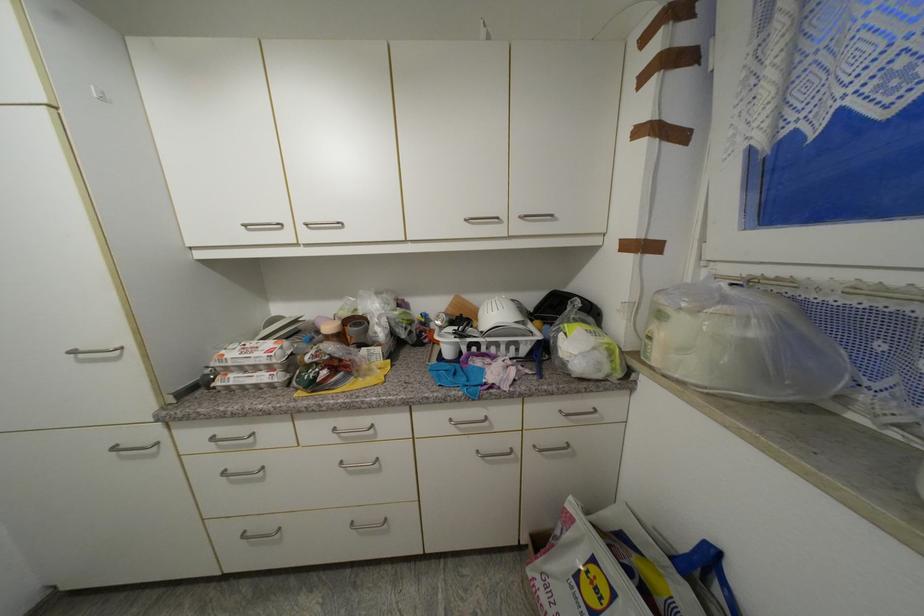
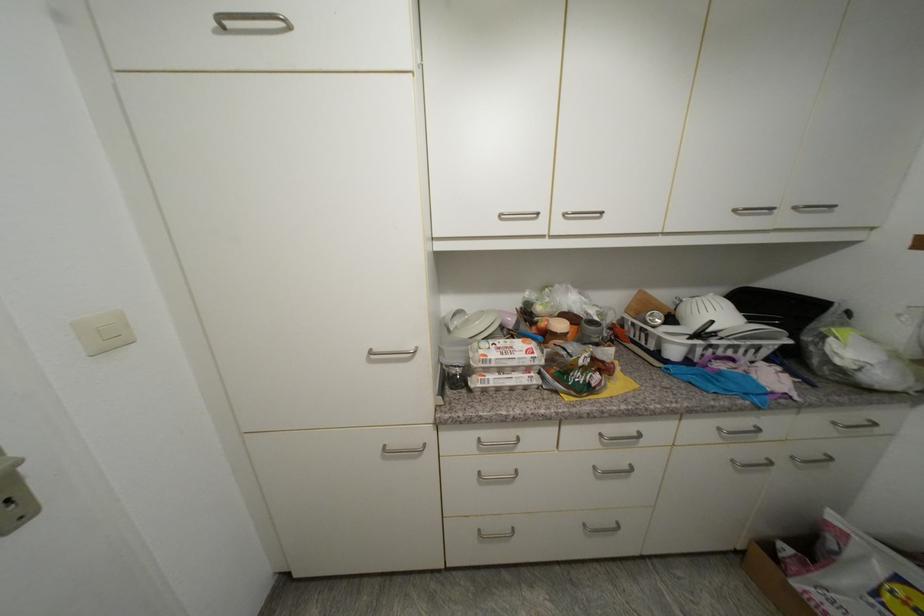
In the second image, find the point that corresponds to point 463,299 in the first image.

(647, 294)